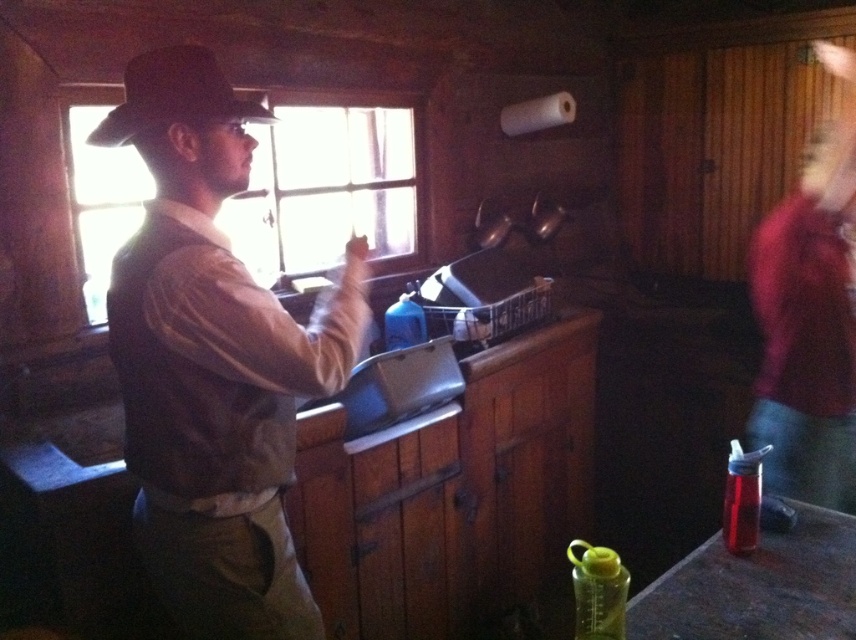
Does brown leather vest at center have a lesser height compared to black felt hat at upper left?

Incorrect, brown leather vest at center's height does not fall short of black felt hat at upper left's.

Which is behind, point (111, 134) or point (150, 54)?

Point (111, 134)

Identify the location of brown leather vest at center. This screenshot has height=640, width=856. (214, 362).

Is point (116, 189) farther from viewer compared to point (158, 115)?

Yes, point (116, 189) is behind point (158, 115).

Can you confirm if wooden frame window at upper center is positioned below black felt hat at upper left?

No, wooden frame window at upper center is not below black felt hat at upper left.

At what (x,y) coordinates should I click in order to perform the action: click on wooden frame window at upper center. Please return your answer as a coordinate pair (x, y). The width and height of the screenshot is (856, 640). Looking at the image, I should click on (324, 189).

Image resolution: width=856 pixels, height=640 pixels. I want to click on brown leather vest at center, so click(214, 362).

Which is in front, point (117, 316) or point (93, 168)?

Point (117, 316)

Identify the location of brown leather vest at center. (x=214, y=362).